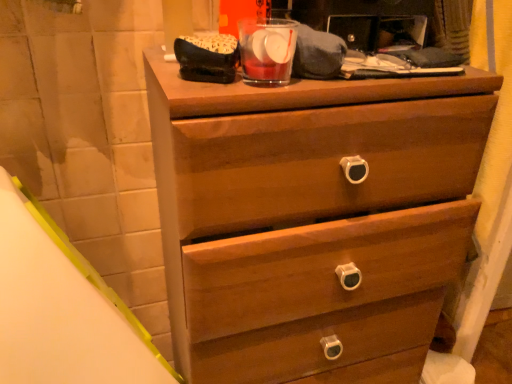
Question: Should I look upward or downward to see transparent glass at upper center?

Choices:
 (A) up
 (B) down

Answer: (A)

Question: From a real-world perspective, is transparent glass at upper center beneath wooden chest of drawers at center?

Choices:
 (A) no
 (B) yes

Answer: (A)

Question: Is transparent glass at upper center to the right of wooden chest of drawers at center from the viewer's perspective?

Choices:
 (A) no
 (B) yes

Answer: (A)

Question: Considering the relative positions of transparent glass at upper center and wooden chest of drawers at center in the image provided, is transparent glass at upper center in front of wooden chest of drawers at center?

Choices:
 (A) yes
 (B) no

Answer: (B)

Question: From a real-world perspective, is transparent glass at upper center located higher than wooden chest of drawers at center?

Choices:
 (A) yes
 (B) no

Answer: (A)

Question: Is transparent glass at upper center facing towards wooden chest of drawers at center?

Choices:
 (A) yes
 (B) no

Answer: (B)

Question: Is transparent glass at upper center to the left of wooden chest of drawers at center from the viewer's perspective?

Choices:
 (A) no
 (B) yes

Answer: (B)

Question: Is transparent glass at upper center a part of wooden chest of drawers at center?

Choices:
 (A) no
 (B) yes

Answer: (A)

Question: Can you confirm if wooden chest of drawers at center is positioned to the right of transparent glass at upper center?

Choices:
 (A) no
 (B) yes

Answer: (B)

Question: From a real-world perspective, is wooden chest of drawers at center physically below transparent glass at upper center?

Choices:
 (A) yes
 (B) no

Answer: (A)

Question: Does wooden chest of drawers at center come behind transparent glass at upper center?

Choices:
 (A) no
 (B) yes

Answer: (A)

Question: Could you tell me if wooden chest of drawers at center is facing transparent glass at upper center?

Choices:
 (A) no
 (B) yes

Answer: (A)

Question: Considering the relative sizes of wooden chest of drawers at center and transparent glass at upper center in the image provided, is wooden chest of drawers at center thinner than transparent glass at upper center?

Choices:
 (A) no
 (B) yes

Answer: (A)

Question: In the image, is wooden chest of drawers at center on the left side or the right side of transparent glass at upper center?

Choices:
 (A) right
 (B) left

Answer: (A)